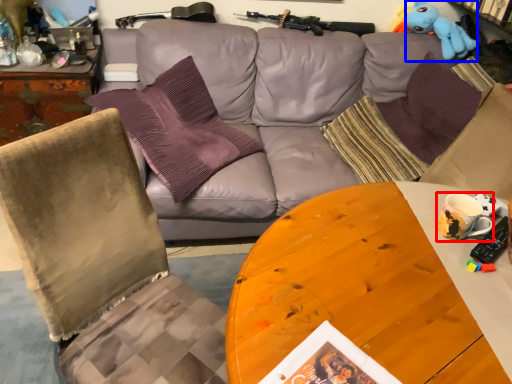
Question: Which object is closer to the camera taking this photo, coffee cup (highlighted by a red box) or toy (highlighted by a blue box)?

Choices:
 (A) coffee cup
 (B) toy

Answer: (A)